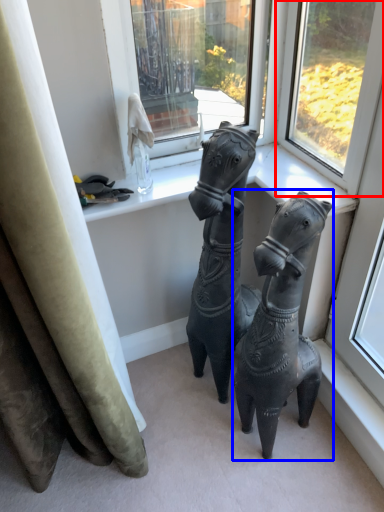
Question: Which point is further to the camera, window (highlighted by a red box) or horse (highlighted by a blue box)?

Choices:
 (A) window
 (B) horse

Answer: (A)